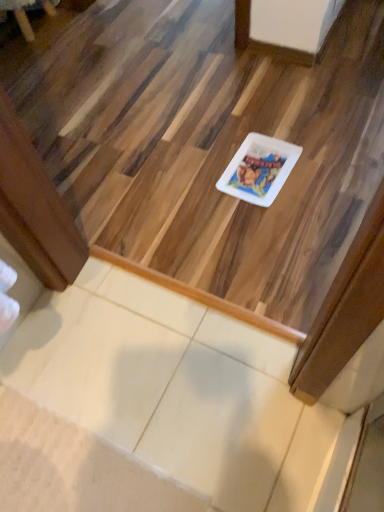
You are a GUI agent. You are given a task and a screenshot of the screen. Output one action in this format:
    pyautogui.click(x=<x>, y=<y>)
    Task: Click on the vacant space that is to the left of white glossy plate at center
    This screenshot has height=512, width=384.
    Given the screenshot: What is the action you would take?
    pyautogui.click(x=198, y=180)